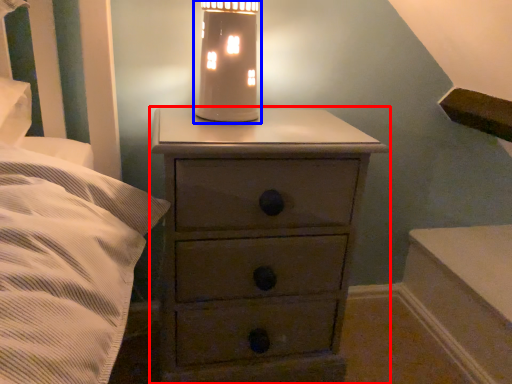
Question: Which object appears farthest to the camera in this image, chest of drawers (highlighted by a red box) or oil lamp (highlighted by a blue box)?

Choices:
 (A) chest of drawers
 (B) oil lamp

Answer: (B)